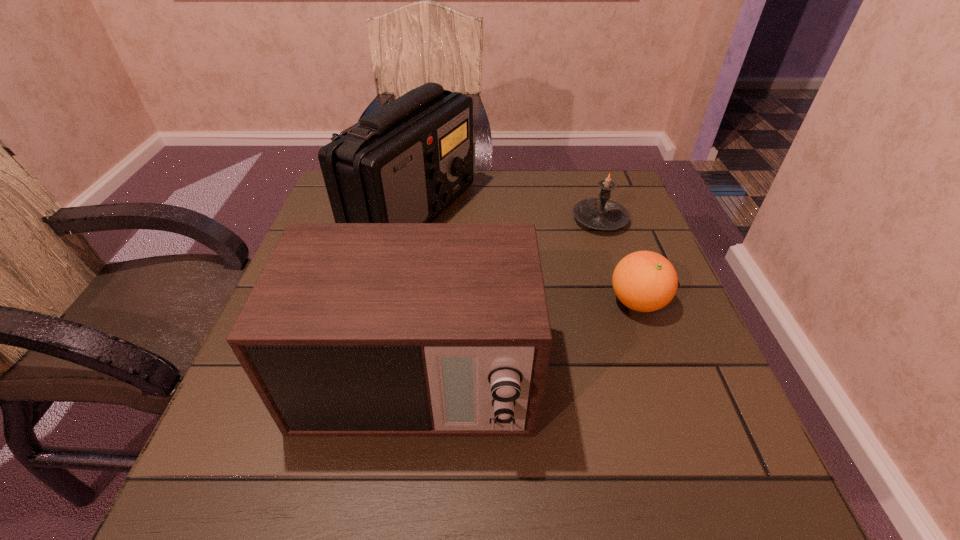
This screenshot has width=960, height=540. Find the location of `free space that satisfies the following two spatial constraints: 1. on the front panel of the orange; 2. on the right side of the taller radio receiver`. free space that satisfies the following two spatial constraints: 1. on the front panel of the orange; 2. on the right side of the taller radio receiver is located at coordinates (396, 302).

Where is `free space that satisfies the following two spatial constraints: 1. on the front side of the orange; 2. on the right side of the candle`? This screenshot has width=960, height=540. free space that satisfies the following two spatial constraints: 1. on the front side of the orange; 2. on the right side of the candle is located at coordinates (627, 302).